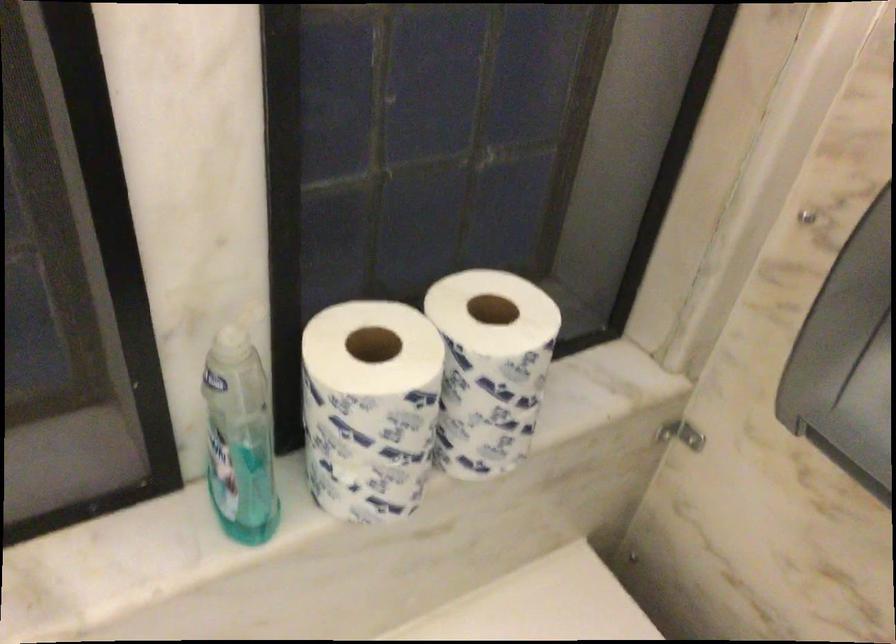
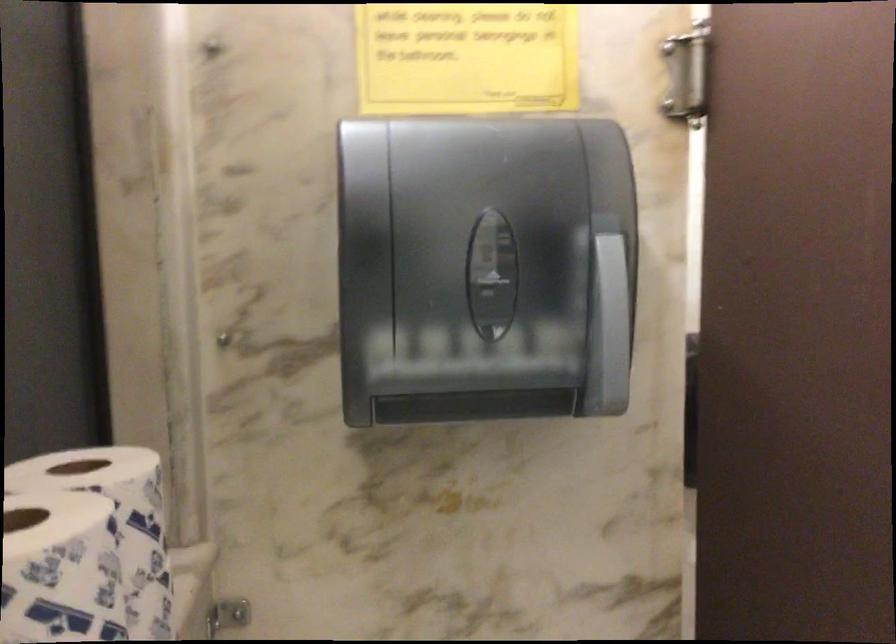
Find the pixel in the second image that matches [434,392] in the first image.

(117, 522)